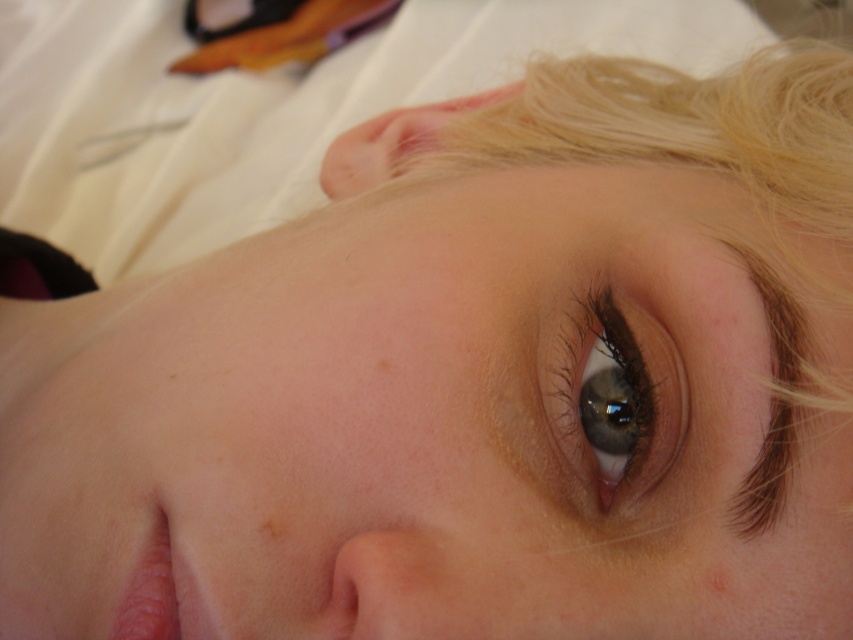
You are a photographer aiming to capture a close portrait of the subject. You are positioned 12 inches away from the blonde hair at upper right. Can you safely move closer to take a sharper photo without invading the subject?

The distance between you and the blonde hair at upper right is 13.05 inches. Since you are currently 12 inches away, you are already closer than the safe distance. Moving closer would invade the subject.

You are a photographer adjusting the focus on your camera. You notice two points in the image at coordinates point (630, 410) and point (636, 333). Based on their positions, which point should you prioritize focusing on to ensure the subject is sharp?

Point (630, 410) should be prioritized because it is in front of point (636, 333), making it closer to the camera and thus the main focus area.